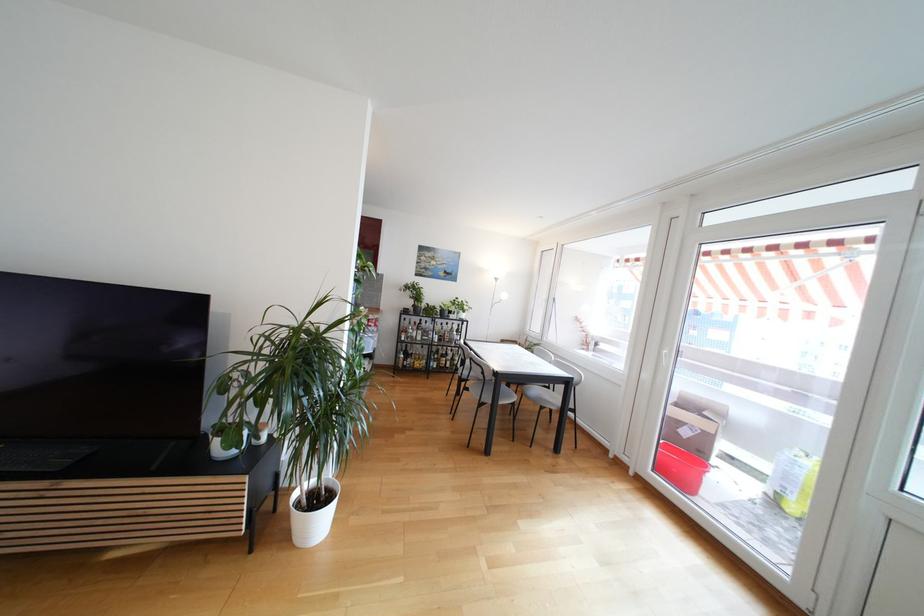
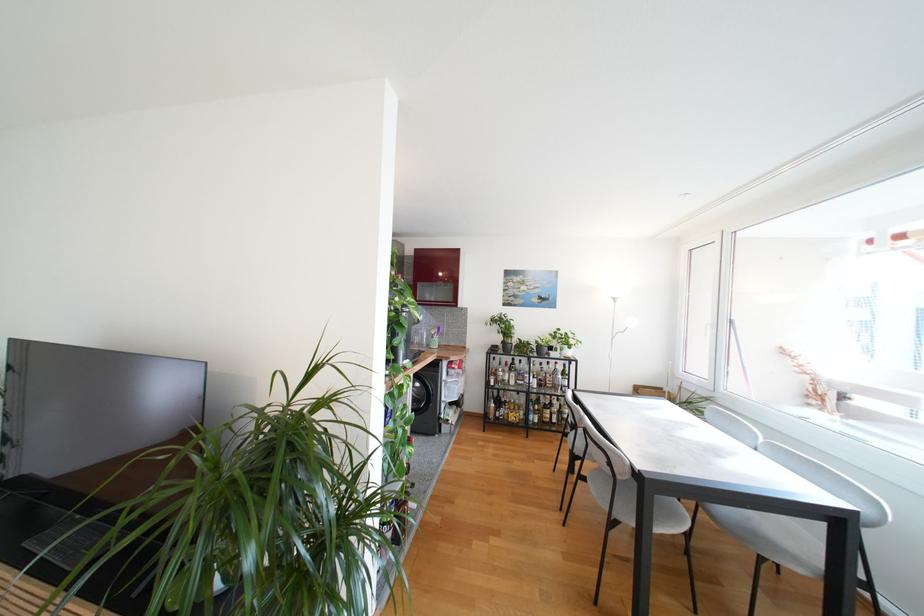
Where in the second image is the point corresponding to point 435,336 from the first image?

(532, 379)